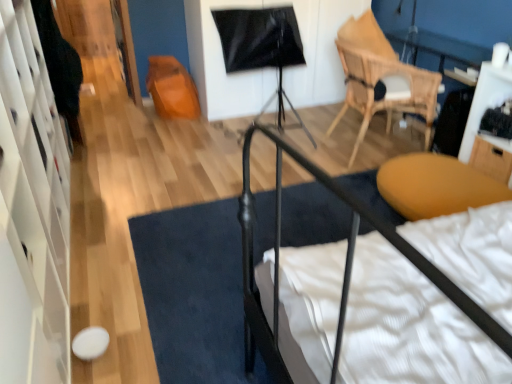
Question: Considering the positions of point (496, 142) and point (51, 34), is point (496, 142) closer or farther from the camera than point (51, 34)?

Choices:
 (A) closer
 (B) farther

Answer: (A)

Question: Considering the positions of wooden drawer at right and black fabric at left in the image, is wooden drawer at right bigger or smaller than black fabric at left?

Choices:
 (A) big
 (B) small

Answer: (B)

Question: Based on their relative distances, which object is nearer to the wooden drawer at right?

Choices:
 (A) black fabric doormat at center
 (B) matte yellow ottoman at lower right
 (C) black fabric at left
 (D) wooden table at right
 (E) white glossy dresser at left

Answer: (D)

Question: Based on their relative distances, which object is nearer to the black fabric at left?

Choices:
 (A) black fabric doormat at center
 (B) wooden drawer at right
 (C) natural wood chair at upper right
 (D) white glossy dresser at left
 (E) matte yellow ottoman at lower right

Answer: (D)